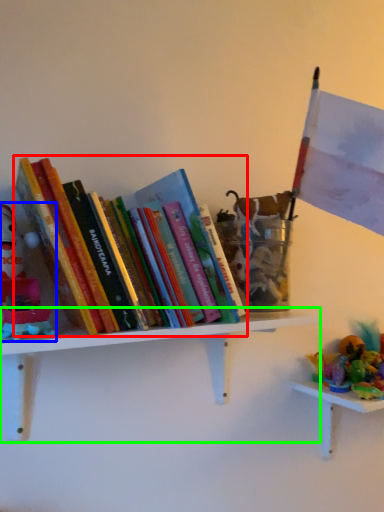
Question: Based on their relative distances, which object is nearer to book (highlighted by a red box)? Choose from toy (highlighted by a blue box) and shelf (highlighted by a green box).

Choices:
 (A) toy
 (B) shelf

Answer: (A)